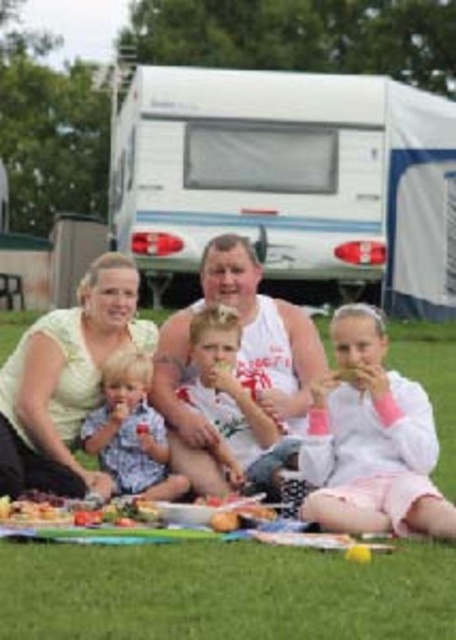
You are planning to take a photo of the family picnic scene. You want to ensure both the white plastic recreational vehicle at upper center and the shiny plastic plate at center are clearly visible. Which object should you focus on first to ensure proper framing?

You should focus on the white plastic recreational vehicle at upper center first because it is larger in size compared to the shiny plastic plate at center, ensuring it fits well within the frame before adjusting for the smaller plate.

Looking at this image, you are planning to set up a tent for a family of five. The tent requires a clear space of 15 feet between the white plastic recreational vehicle at upper center and the green grass at lower center where you want to pitch it. Is the available distance sufficient?

The white plastic recreational vehicle at upper center and green grass at lower center are 16.19 feet apart. Since the required space is 15 feet, the distance is sufficient for setting up the tent.